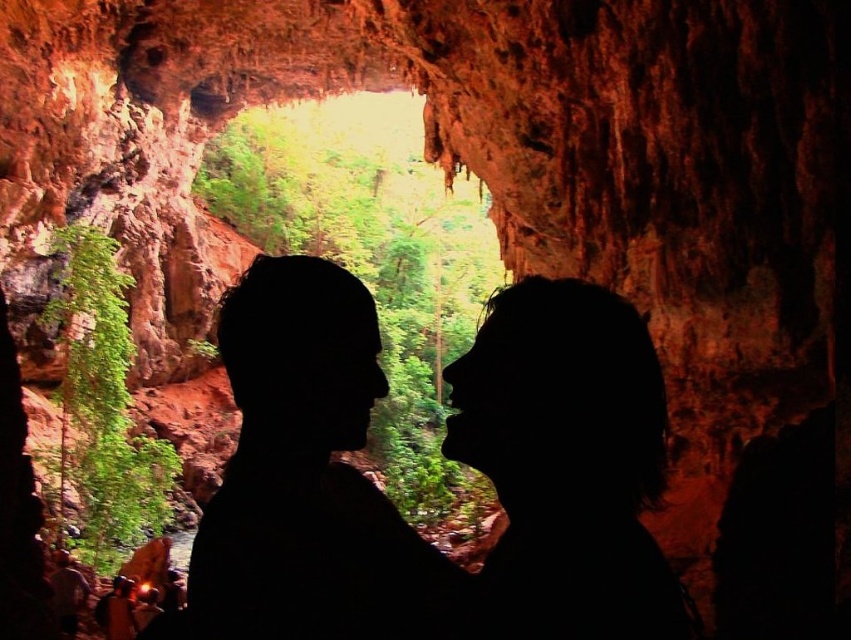
Is black silhouette couple at center taller than silhouette hair at center?

Yes.

Consider the image. Is black silhouette couple at center further to camera compared to silhouette hair at center?

No, it is in front of silhouette hair at center.

Find the location of `black silhouette couple at center`. black silhouette couple at center is located at coordinates (444, 456).